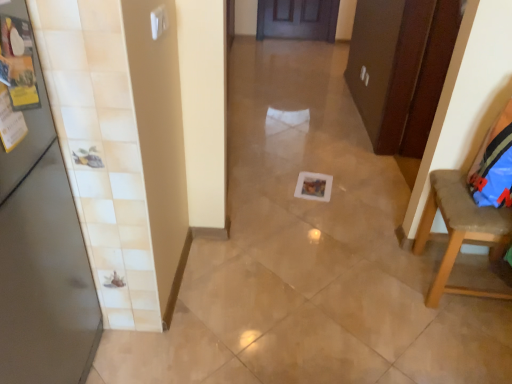
Question: Considering the relative sizes of brown fabric chair at right and metallic gray door at left in the image provided, is brown fabric chair at right smaller than metallic gray door at left?

Choices:
 (A) no
 (B) yes

Answer: (B)

Question: From the image's perspective, does brown fabric chair at right appear lower than metallic gray door at left?

Choices:
 (A) yes
 (B) no

Answer: (B)

Question: Is brown fabric chair at right to the right of metallic gray door at left from the viewer's perspective?

Choices:
 (A) no
 (B) yes

Answer: (B)

Question: Is brown fabric chair at right directly adjacent to metallic gray door at left?

Choices:
 (A) no
 (B) yes

Answer: (A)

Question: From a real-world perspective, is brown fabric chair at right physically above metallic gray door at left?

Choices:
 (A) yes
 (B) no

Answer: (B)

Question: Considering the relative sizes of brown fabric chair at right and metallic gray door at left in the image provided, is brown fabric chair at right taller than metallic gray door at left?

Choices:
 (A) no
 (B) yes

Answer: (A)

Question: Does metallic gray door at left come in front of brown fabric chair at right?

Choices:
 (A) yes
 (B) no

Answer: (A)

Question: Is metallic gray door at left outside of brown fabric chair at right?

Choices:
 (A) yes
 (B) no

Answer: (A)

Question: Does metallic gray door at left have a larger size compared to brown fabric chair at right?

Choices:
 (A) yes
 (B) no

Answer: (A)

Question: Is metallic gray door at left oriented away from brown fabric chair at right?

Choices:
 (A) yes
 (B) no

Answer: (B)

Question: Does metallic gray door at left have a smaller size compared to brown fabric chair at right?

Choices:
 (A) no
 (B) yes

Answer: (A)

Question: Is metallic gray door at left behind brown fabric chair at right?

Choices:
 (A) yes
 (B) no

Answer: (B)

Question: From the image's perspective, is metallic gray door at left positioned above or below brown fabric chair at right?

Choices:
 (A) above
 (B) below

Answer: (B)